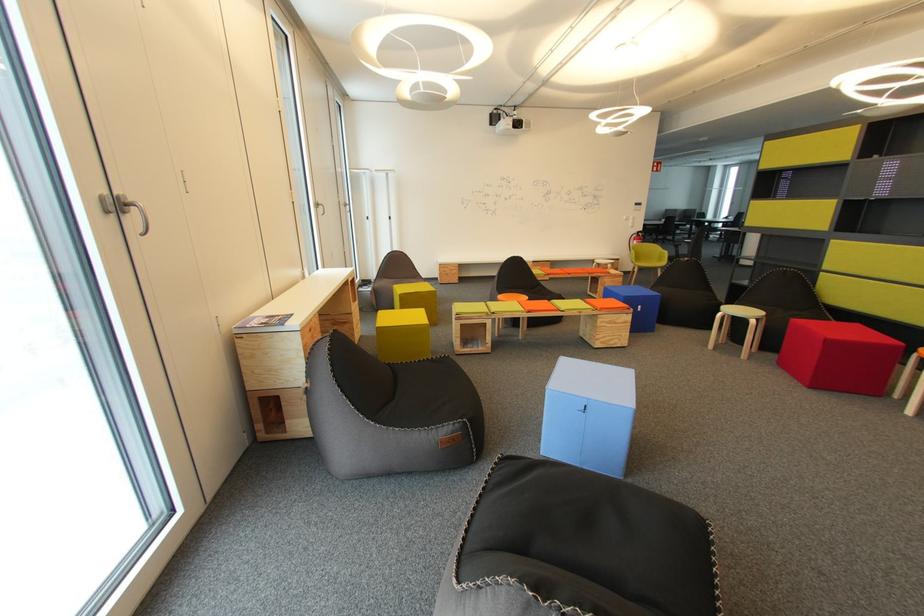
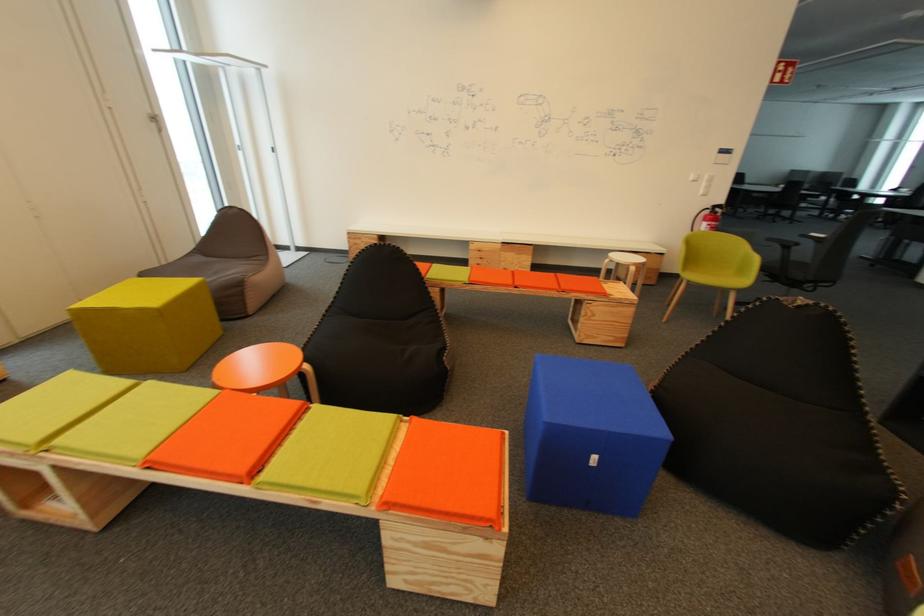
The images are taken continuously from a first-person perspective. In which direction are you moving?

The cameraman walked toward right, forward.